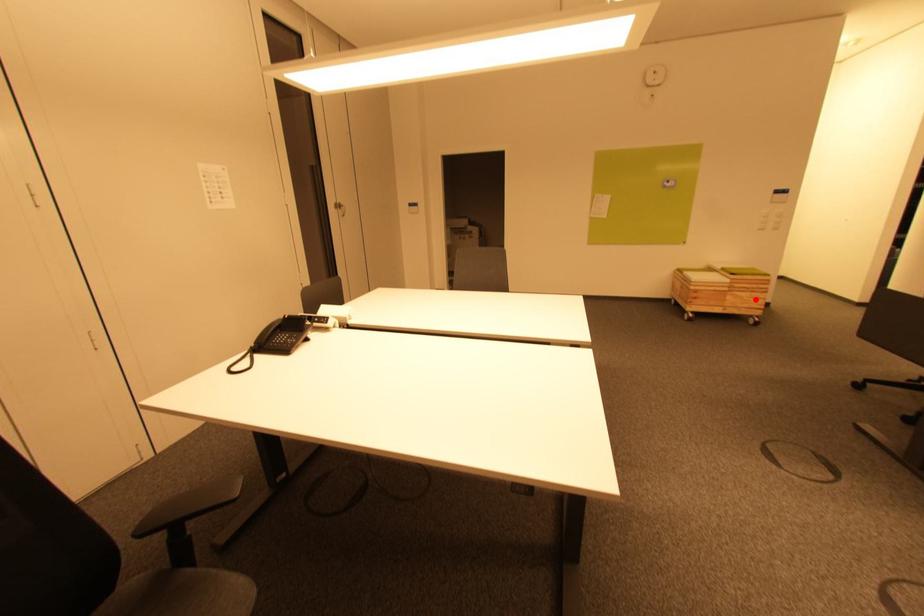
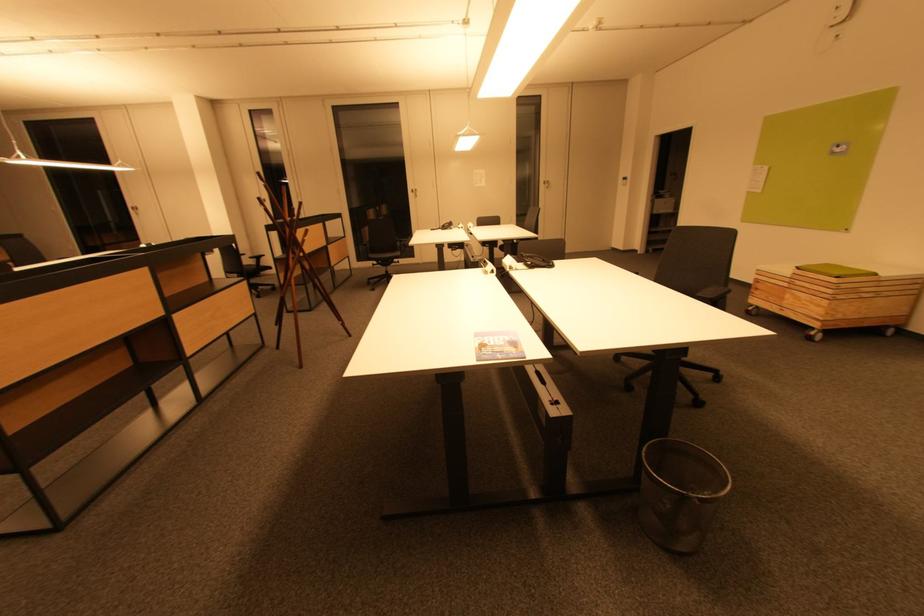
Question: I am providing you with two images of the same scene from different viewpoints. A red point is marked on the first image. Is the red point's position out of view in image 2?

Choices:
 (A) Yes
 (B) No

Answer: (B)